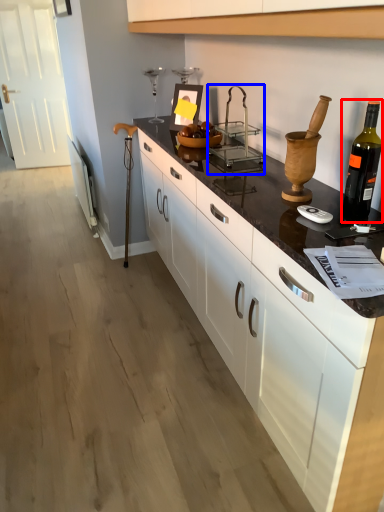
Question: Which object is closer to the camera taking this photo, bottle (highlighted by a red box) or appliance (highlighted by a blue box)?

Choices:
 (A) bottle
 (B) appliance

Answer: (A)